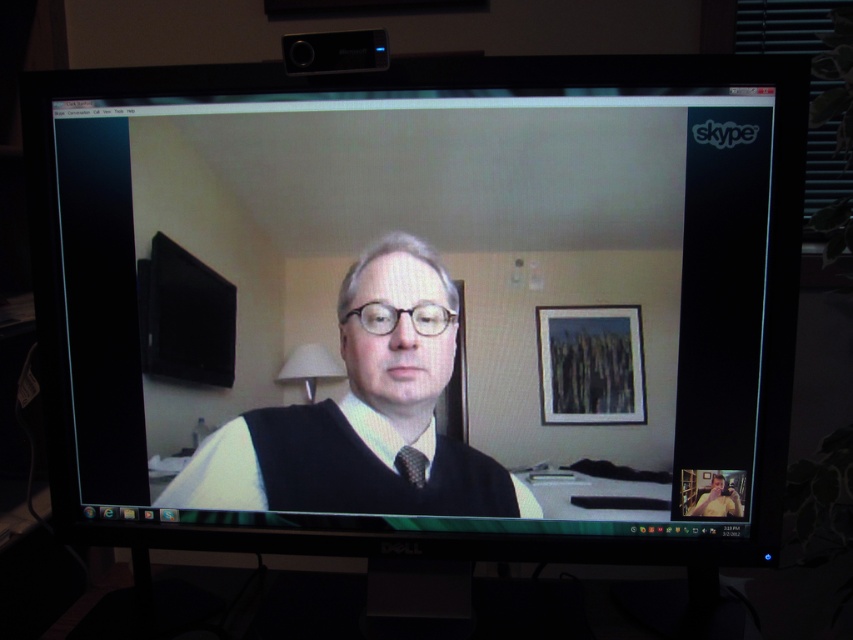
Question: Is matte black sweater at center to the left of black textured tie at center from the viewer's perspective?

Choices:
 (A) yes
 (B) no

Answer: (A)

Question: Can you confirm if matte black sweater at center is wider than black textured tie at center?

Choices:
 (A) no
 (B) yes

Answer: (B)

Question: Is matte black sweater at center positioned behind black textured tie at center?

Choices:
 (A) yes
 (B) no

Answer: (B)

Question: Which of the following is the closest to the observer?

Choices:
 (A) (471, 483)
 (B) (418, 484)

Answer: (A)